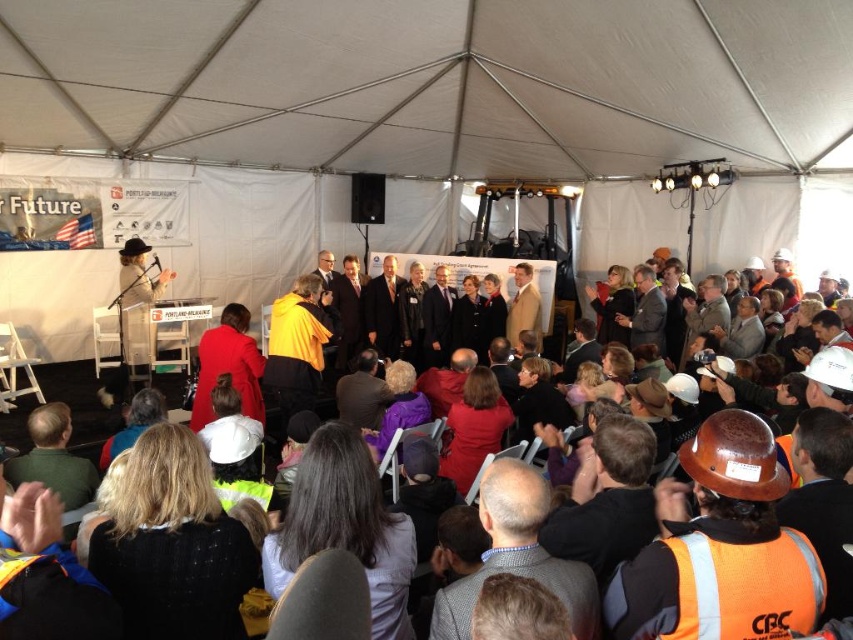
You are a photographer at the event and need to capture a photo of both the dark gray suit at center and the light brown leather jacket at center. Based on their positions, which one should you focus on first to ensure both are in frame?

You should focus on the light brown leather jacket at center first because the dark gray suit at center is located below it, so adjusting the camera angle to include the upper part first will naturally include the lower one as well.

You are a photographer at the event and want to capture both the yellow fabric at center and the beige wool coat at center in the same frame. Which object should you focus on first to ensure both are in focus?

You should focus on the yellow fabric at center first since it is in front of the beige wool coat at center, allowing both to be in focus when focusing on the closer object.